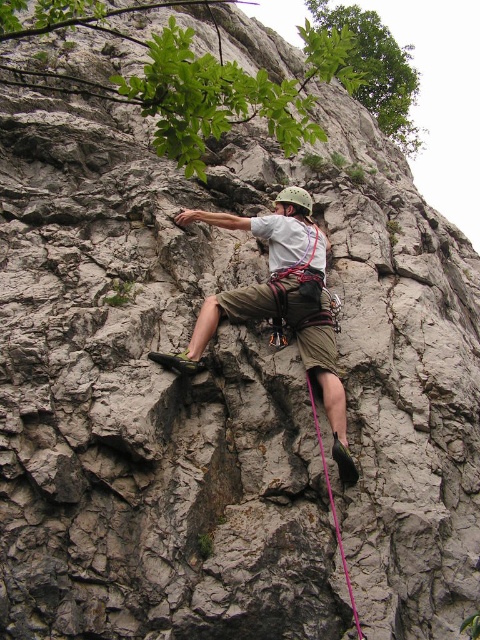
Can you confirm if matte khaki shorts at center is positioned to the left of pink nylon rope at lower center?

Indeed, matte khaki shorts at center is positioned on the left side of pink nylon rope at lower center.

Does matte khaki shorts at center appear over pink nylon rope at lower center?

Indeed, matte khaki shorts at center is positioned over pink nylon rope at lower center.

Who is more distant from viewer, (x=279, y=285) or (x=337, y=529)?

Positioned behind is point (x=279, y=285).

You are a GUI agent. You are given a task and a screenshot of the screen. Output one action in this format:
    pyautogui.click(x=<x>, y=<y>)
    Task: Click on the matte khaki shorts at center
    This screenshot has height=640, width=480.
    Given the screenshot: What is the action you would take?
    (x=280, y=301)